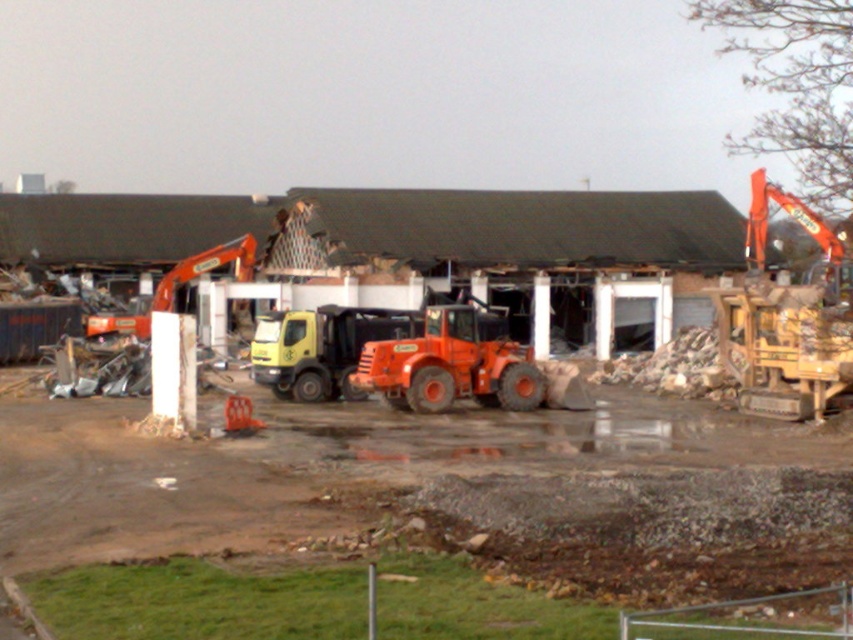
In the scene shown: You are a construction worker who needs to move a heavy beam from the orange rubber tractor at center to the orange metallic excavator at left. Given that the tractor can carry the beam for 10 meters before needing to stop, will you be able to transport it directly without stopping?

The orange rubber tractor at center is 12.93 meters away from the orange metallic excavator at left. Since the tractor can only carry the beam for 10 meters before stopping, it will need to stop along the way to transport the beam the remaining distance.

You are a delivery driver who needs to park your truck near the orange metallic excavator at left. There is an orange rubber tractor at center blocking the path. Can you drive around it to reach the excavator?

The orange rubber tractor at center is in front of the orange metallic excavator at left, so you can drive around it to reach the excavator since the tractor is blocking the direct path but not the entire area.

You are a construction worker needing to transport materials across the muddy ground. You have access to the orange rubber tractor at center and the orange metallic excavator at left. Which vehicle should you choose to avoid getting stuck, considering their widths?

The orange rubber tractor at center has a lesser width compared to the orange metallic excavator at left, so it is more suitable for navigating the muddy ground without getting stuck.